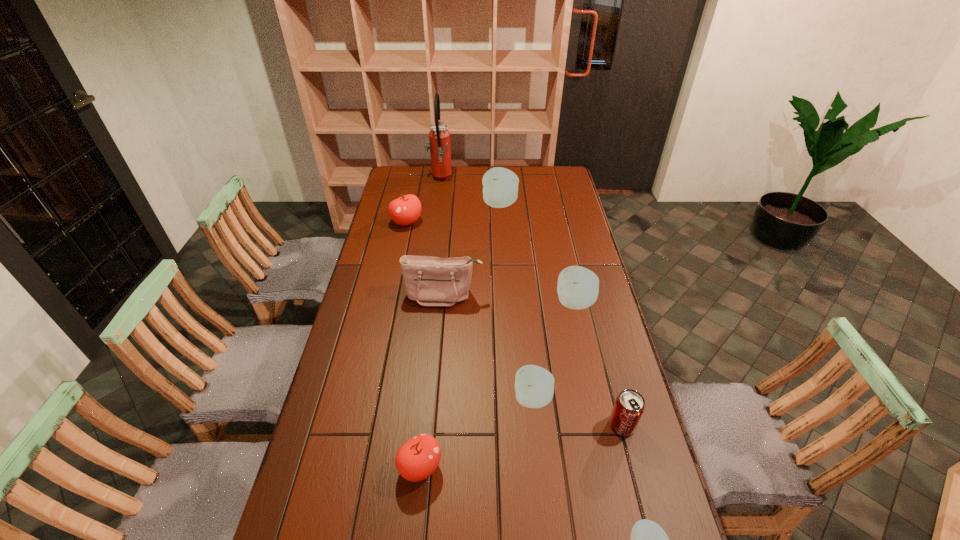
This screenshot has width=960, height=540. In order to click on fire extinguisher in this screenshot , I will do `click(439, 137)`.

Identify the location of the tallest object. Image resolution: width=960 pixels, height=540 pixels. (439, 137).

Locate an element on the screen. The height and width of the screenshot is (540, 960). the farthest white apple is located at coordinates (500, 185).

Find the location of `the biggest white apple`. the biggest white apple is located at coordinates click(x=500, y=185).

Locate an element on the screen. This screenshot has height=540, width=960. shoulder bag is located at coordinates (430, 281).

Where is `the third smallest white apple`? the third smallest white apple is located at coordinates (578, 287).

At what (x,y) coordinates should I click in order to perform the action: click on the fourth nearest apple. Please return your answer as a coordinate pair (x, y). The height and width of the screenshot is (540, 960). Looking at the image, I should click on [578, 287].

Find the location of `the bigger red apple`. the bigger red apple is located at coordinates (405, 210).

The width and height of the screenshot is (960, 540). Find the location of `the farther red apple`. the farther red apple is located at coordinates (405, 210).

Where is `red pop soda`? The width and height of the screenshot is (960, 540). red pop soda is located at coordinates (629, 406).